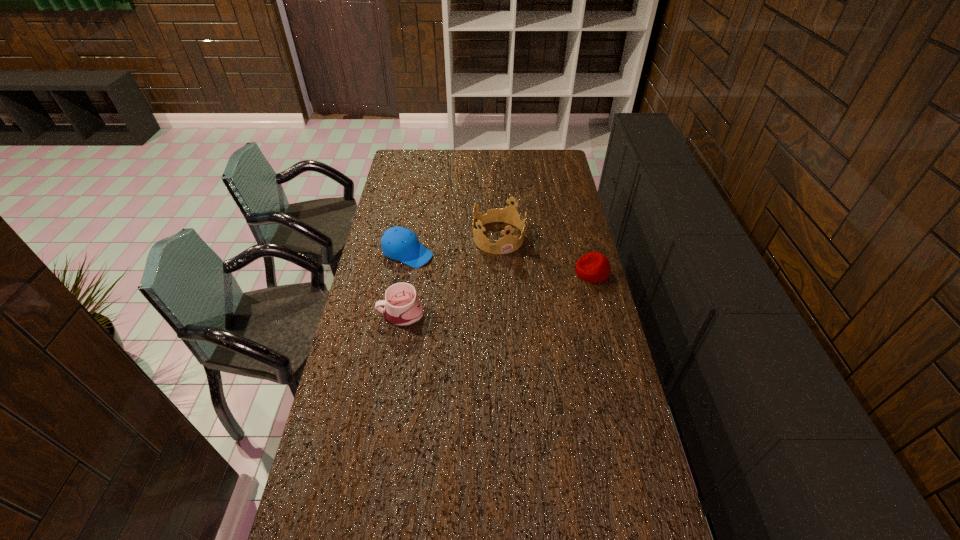
Identify the location of free space between the shortest object and the third object from left to right. (545, 254).

I want to click on vacant space that's between the tiara and the mug, so click(x=449, y=275).

Where is `vacant region between the mug and the rightmost object`? Image resolution: width=960 pixels, height=540 pixels. vacant region between the mug and the rightmost object is located at coordinates (496, 293).

Identify the location of object that is the closest one to the rightmost object. (507, 244).

Find the location of a particular element. the third closest object to the tallest object is located at coordinates (402, 308).

Find the location of `free spot that satisfies the following two spatial constraints: 1. on the front side of the cap; 2. on the side with the handle of the mug`. free spot that satisfies the following two spatial constraints: 1. on the front side of the cap; 2. on the side with the handle of the mug is located at coordinates (397, 314).

Locate an element on the screen. free region that satisfies the following two spatial constraints: 1. on the front side of the mug; 2. on the side with the handle of the cap is located at coordinates (397, 314).